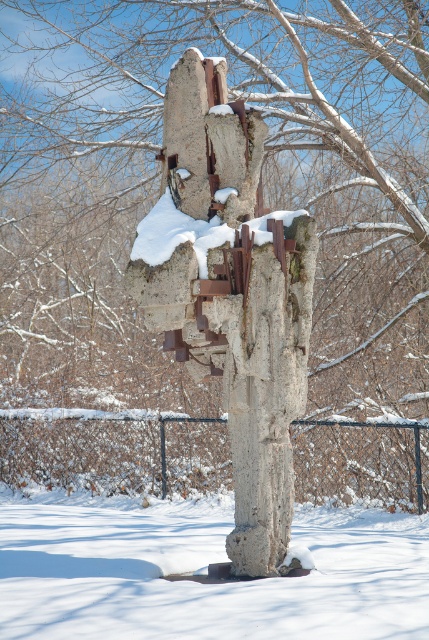
You are standing at the point with coordinates point (230, 292) in a snowy landscape. What is the object located at your current position?

The point (230, 292) is located on the rusty concrete sculpture at center.